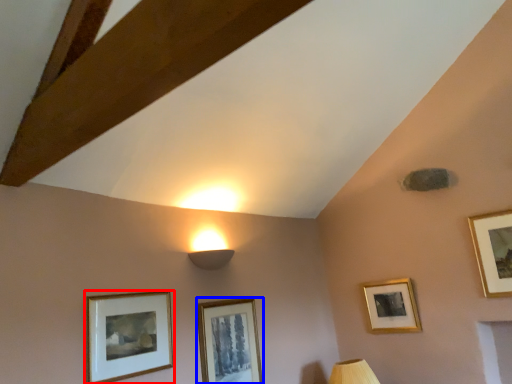
Question: Among these objects, which one is farthest to the camera, picture frame (highlighted by a red box) or picture frame (highlighted by a blue box)?

Choices:
 (A) picture frame
 (B) picture frame

Answer: (B)